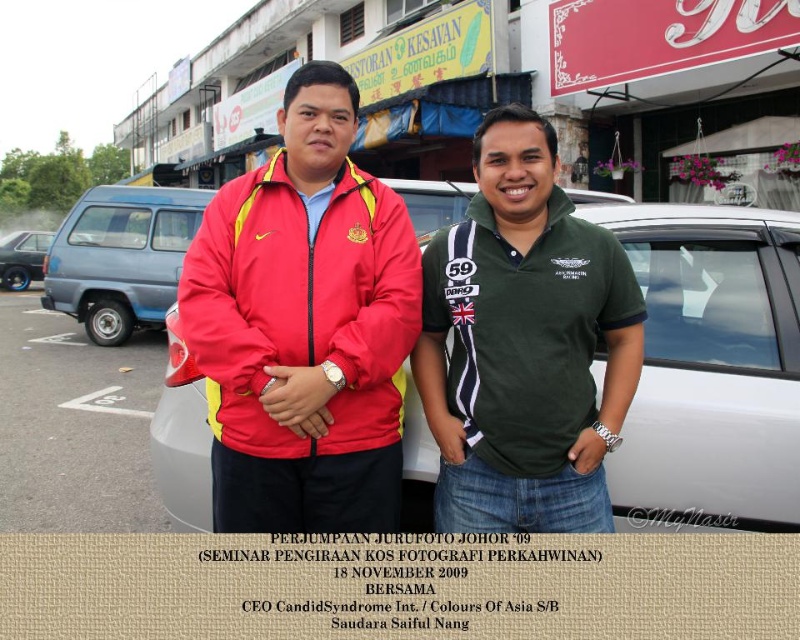
Question: Which object is farther from the camera taking this photo?

Choices:
 (A) blue matte van at left
 (B) matte nylon jacket at center

Answer: (A)

Question: Can you confirm if satin silver car at center is positioned above blue metallic sedan at left?

Choices:
 (A) yes
 (B) no

Answer: (B)

Question: Does green cotton polo shirt at center have a greater width compared to blue metallic sedan at left?

Choices:
 (A) no
 (B) yes

Answer: (B)

Question: Which object is the closest to the blue matte van at left?

Choices:
 (A) matte nylon jacket at center
 (B) satin silver car at center
 (C) blue metallic sedan at left
 (D) green cotton polo shirt at center

Answer: (A)

Question: Which object is closer to the camera taking this photo?

Choices:
 (A) satin silver car at center
 (B) matte nylon jacket at center

Answer: (B)

Question: Does green cotton polo shirt at center have a smaller size compared to blue metallic sedan at left?

Choices:
 (A) yes
 (B) no

Answer: (B)